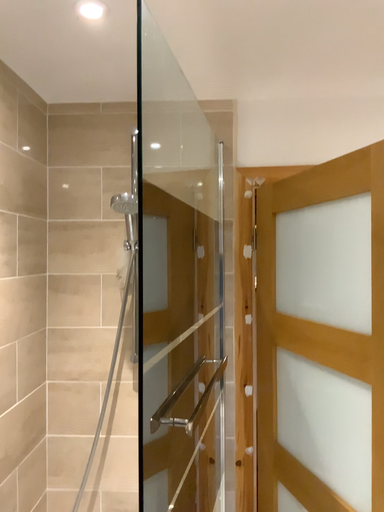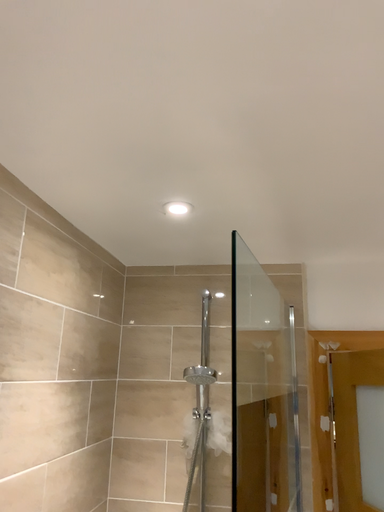
Question: How did the camera likely rotate when shooting the video?

Choices:
 (A) rotated downward
 (B) rotated upward

Answer: (B)